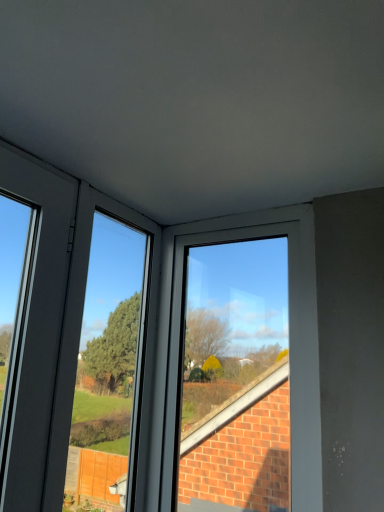
The width and height of the screenshot is (384, 512). Describe the element at coordinates (107, 294) in the screenshot. I see `matte gray window frame at center` at that location.

Where is `matte gray window frame at center`? The width and height of the screenshot is (384, 512). matte gray window frame at center is located at coordinates (107, 294).

Measure the distance between white plastic window at center and camera.

white plastic window at center is 4.08 feet from camera.

This screenshot has height=512, width=384. Identify the location of white plastic window at center. (236, 376).

What do you see at coordinates (236, 376) in the screenshot?
I see `white plastic window at center` at bounding box center [236, 376].

Find the location of a particular element. The height and width of the screenshot is (512, 384). matte gray window frame at center is located at coordinates 107,294.

Which is more to the right, white plastic window at center or matte gray window frame at center?

Answer: Positioned to the right is white plastic window at center.

In the image, is white plastic window at center positioned in front of or behind matte gray window frame at center?

white plastic window at center is behind matte gray window frame at center.

Which point is more forward, (220, 432) or (109, 426)?

The point (109, 426) is more forward.

Looking at this image, from the image's perspective, does white plastic window at center appear lower than matte gray window frame at center?

Yes, from the image's perspective, white plastic window at center is beneath matte gray window frame at center.

From a real-world perspective, is white plastic window at center physically located above or below matte gray window frame at center?

white plastic window at center is situated higher than matte gray window frame at center in the real world.

From the picture: Is white plastic window at center wider than matte gray window frame at center?

Yes, white plastic window at center is wider than matte gray window frame at center.

Considering the sizes of objects white plastic window at center and matte gray window frame at center in the image provided, who is shorter, white plastic window at center or matte gray window frame at center?

With less height is matte gray window frame at center.

Considering the sizes of white plastic window at center and matte gray window frame at center in the image, is white plastic window at center bigger or smaller than matte gray window frame at center?

Considering their sizes, white plastic window at center takes up more space than matte gray window frame at center.

Is white plastic window at center spatially inside matte gray window frame at center, or outside of it?

white plastic window at center exists outside the volume of matte gray window frame at center.

Consider the image. Does white plastic window at center touch matte gray window frame at center?

No, white plastic window at center is not in contact with matte gray window frame at center.

Is white plastic window at center looking in the opposite direction of matte gray window frame at center?

A: No, white plastic window at center is not facing the opposite direction of matte gray window frame at center.

How many degrees apart are the facing directions of white plastic window at center and matte gray window frame at center?

The angular difference between white plastic window at center and matte gray window frame at center is 90 degrees.

How far apart are white plastic window at center and matte gray window frame at center?

A distance of 11.98 inches exists between white plastic window at center and matte gray window frame at center.

Identify the location of bay window on the right of the matte gray window frame at center. The width and height of the screenshot is (384, 512). (236, 376).

Can you confirm if matte gray window frame at center is positioned to the left of white plastic window at center?

Yes.

In the scene shown: Between matte gray window frame at center and white plastic window at center, which one is positioned in front?

Positioned in front is matte gray window frame at center.

Is point (153, 261) farther from viewer compared to point (250, 330)?

Yes, point (153, 261) is behind point (250, 330).

From the image's perspective, which is below, matte gray window frame at center or white plastic window at center?

white plastic window at center, from the image's perspective.

Consider the image. From a real-world perspective, which object stands above the other?

white plastic window at center, from a real-world perspective.

Does matte gray window frame at center have a greater width compared to white plastic window at center?

No.

Based on the photo, which of these two, matte gray window frame at center or white plastic window at center, stands shorter?

matte gray window frame at center.

Is matte gray window frame at center bigger or smaller than white plastic window at center?

In the image, matte gray window frame at center appears to be smaller than white plastic window at center.

Would you say matte gray window frame at center is inside or outside white plastic window at center?

matte gray window frame at center cannot be found inside white plastic window at center.

Is matte gray window frame at center far away from white plastic window at center?

That's not correct — matte gray window frame at center is a little close to white plastic window at center.

In the scene shown: Is matte gray window frame at center positioned with its back to white plastic window at center?

That's not correct — matte gray window frame at center is not looking away from white plastic window at center.

From the picture: Measure the distance between matte gray window frame at center and white plastic window at center.

matte gray window frame at center and white plastic window at center are 11.98 inches apart.

I want to click on window frame on the left of white plastic window at center, so click(x=107, y=294).

Locate an element on the screen. window frame above the white plastic window at center (from the image's perspective) is located at coordinates click(107, 294).

In order to click on bay window located on the right of matte gray window frame at center in this screenshot , I will do `click(236, 376)`.